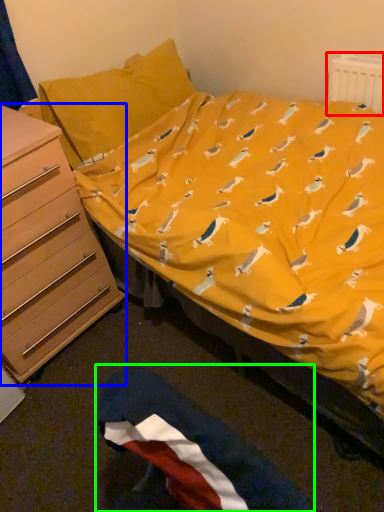
Question: Which object is the closest to the radiator (highlighted by a red box)? Choose among these: chest of drawers (highlighted by a blue box) or flag (highlighted by a green box).

Choices:
 (A) chest of drawers
 (B) flag

Answer: (A)